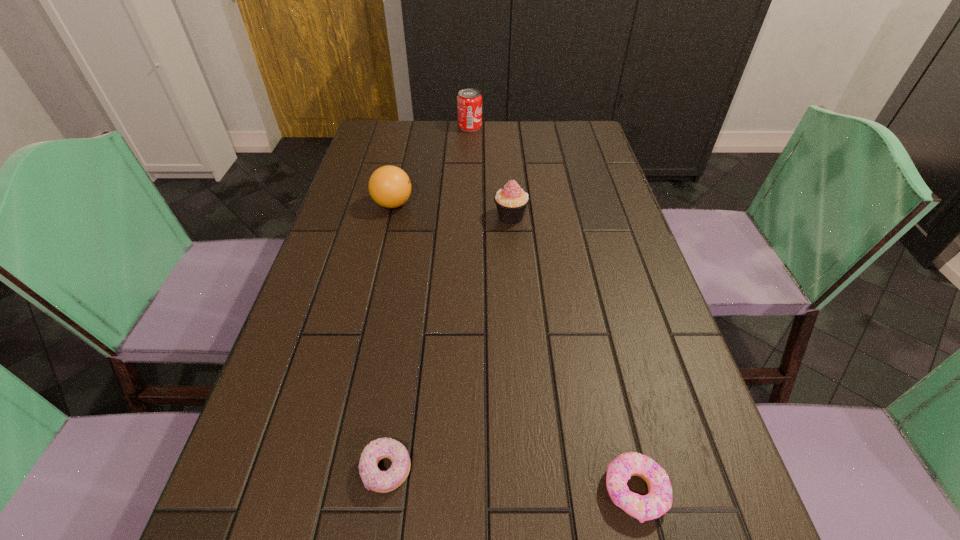
Where is `vacant area between the third object from right to left and the ping-pong ball`? This screenshot has height=540, width=960. vacant area between the third object from right to left and the ping-pong ball is located at coordinates tap(431, 166).

In order to click on empty location between the cupcake and the can in this screenshot , I will do `click(491, 172)`.

Locate an element on the screen. The width and height of the screenshot is (960, 540). free area in between the rightmost object and the can is located at coordinates (553, 309).

Where is `free space between the second object from right to left and the farthest object`? free space between the second object from right to left and the farthest object is located at coordinates (491, 172).

Locate an element on the screen. vacant area that lies between the fourth object from left to right and the ping-pong ball is located at coordinates (452, 211).

Image resolution: width=960 pixels, height=540 pixels. I want to click on vacant space in between the rightmost object and the ping-pong ball, so 515,348.

Find the location of a particular element. This screenshot has height=540, width=960. free space between the left doughnut and the ping-pong ball is located at coordinates (390, 337).

I want to click on unoccupied area between the rightmost object and the farthest object, so click(x=553, y=309).

At what (x,y) coordinates should I click in order to perform the action: click on vacant area that lies between the fourth object from left to right and the farthest object. Please return your answer as a coordinate pair (x, y). Image resolution: width=960 pixels, height=540 pixels. Looking at the image, I should click on (491, 172).

Identify which object is the third closest to the left doughnut. Please provide its 2D coordinates. Your answer should be formatted as a tuple, i.e. [(x, y)], where the tuple contains the x and y coordinates of a point satisfying the conditions above.

[(389, 186)]